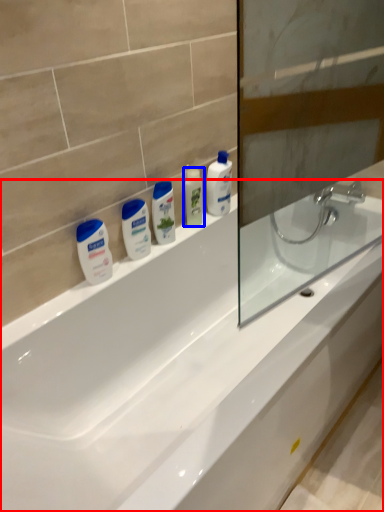
Question: Which of the following is the closest to the observer, bathtub (highlighted by a red box) or mouthwash (highlighted by a blue box)?

Choices:
 (A) bathtub
 (B) mouthwash

Answer: (A)